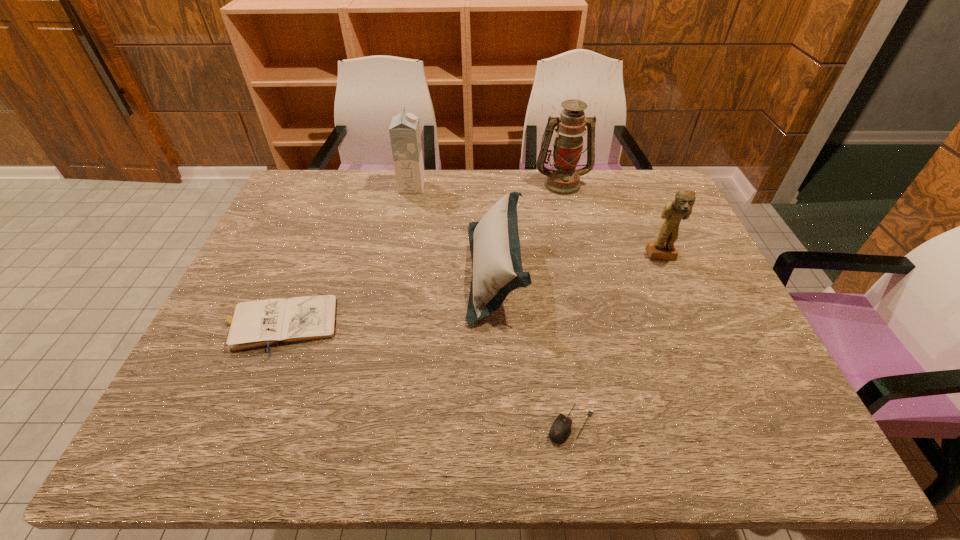
Find the location of a particular element. object that is at the right edge is located at coordinates (674, 211).

Where is `free location at the far edge`? free location at the far edge is located at coordinates (542, 177).

Identify the location of free space at the near edge of the desktop. This screenshot has height=540, width=960. (689, 455).

Find the location of a particular element. blank space at the left edge of the desktop is located at coordinates (296, 214).

The width and height of the screenshot is (960, 540). I want to click on vacant area that lies between the carton and the third object from left to right, so click(x=454, y=229).

I want to click on vacant point located between the fourth tallest object and the oil lamp, so click(529, 228).

Locate an element on the screen. Image resolution: width=960 pixels, height=540 pixels. free space between the oil lamp and the fourth tallest object is located at coordinates 529,228.

Locate an element on the screen. vacant point located between the cushion and the figurine is located at coordinates (578, 264).

This screenshot has width=960, height=540. I want to click on free space between the oil lamp and the second object from left to right, so click(487, 185).

This screenshot has width=960, height=540. Find the location of `free spot between the carton and the third tallest object`. free spot between the carton and the third tallest object is located at coordinates (537, 221).